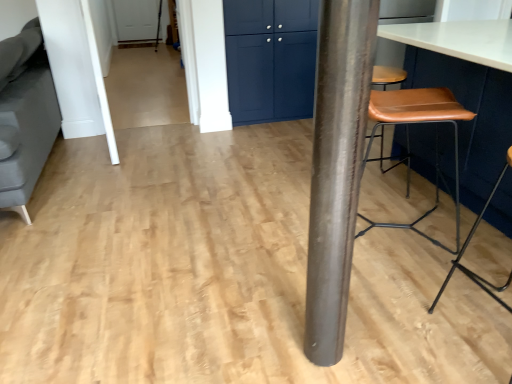
Where is `free area in between brown leather stool at right and shiny metallic pole at center`? Image resolution: width=512 pixels, height=384 pixels. free area in between brown leather stool at right and shiny metallic pole at center is located at coordinates click(x=396, y=346).